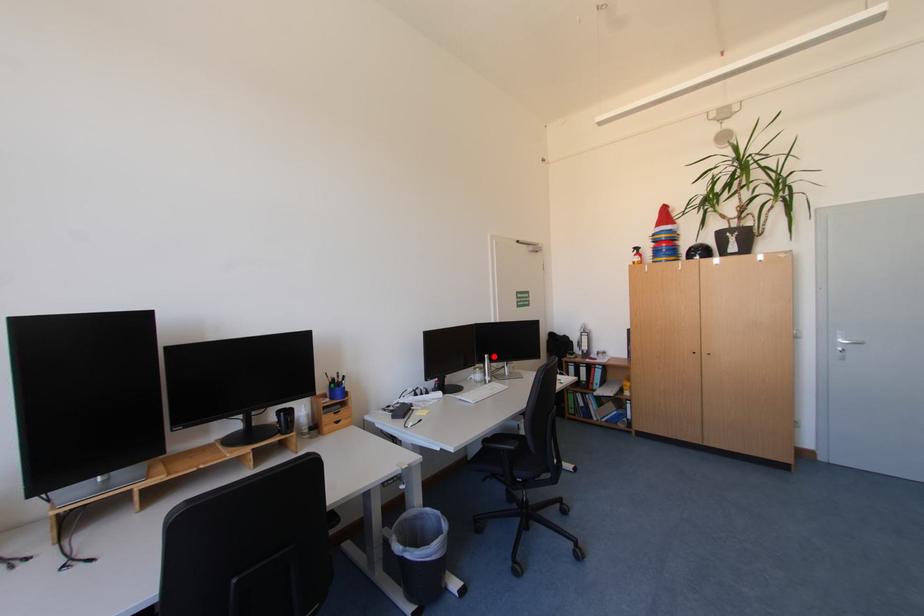
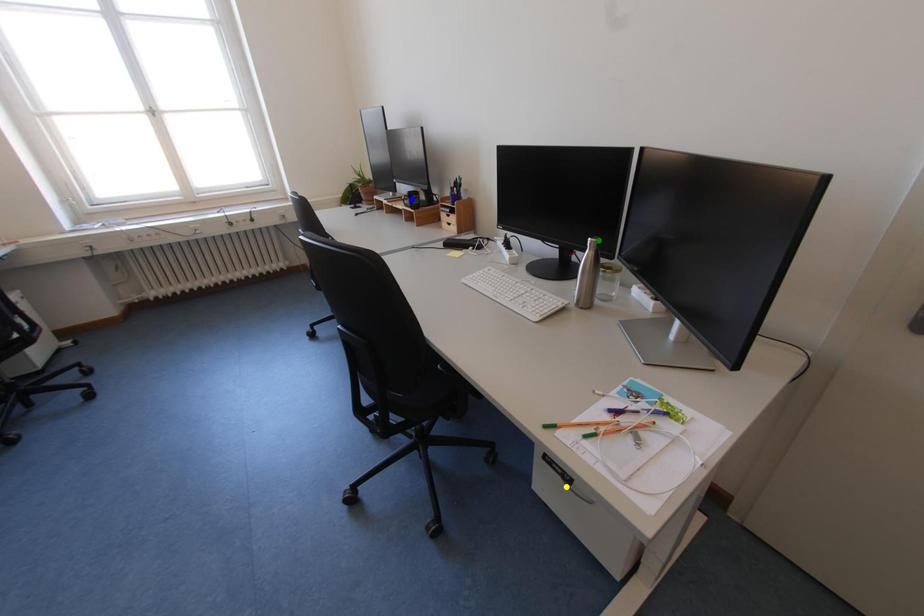
Question: I am providing you with two images of the same scene from different viewpoints. A red point is marked on the first image. You are given multiple points on the second image. Can you choose the point in image 2 that corresponds to the point in image 1?

Choices:
 (A) green point
 (B) blue point
 (C) yellow point

Answer: (A)